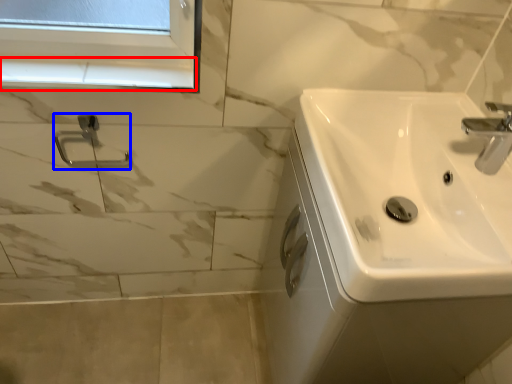
Question: Which point is closer to the camera, window sill (highlighted by a red box) or shower (highlighted by a blue box)?

Choices:
 (A) window sill
 (B) shower

Answer: (A)